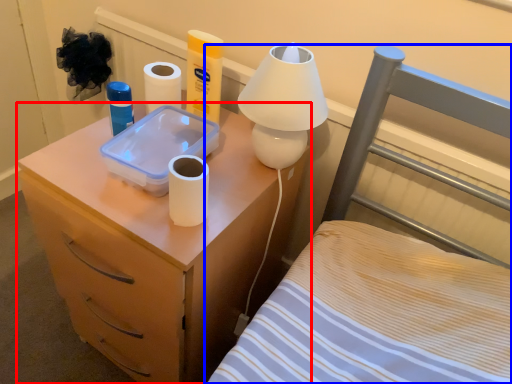
Question: Which object appears farthest to the camera in this image, nightstand (highlighted by a red box) or furniture (highlighted by a blue box)?

Choices:
 (A) nightstand
 (B) furniture

Answer: (B)